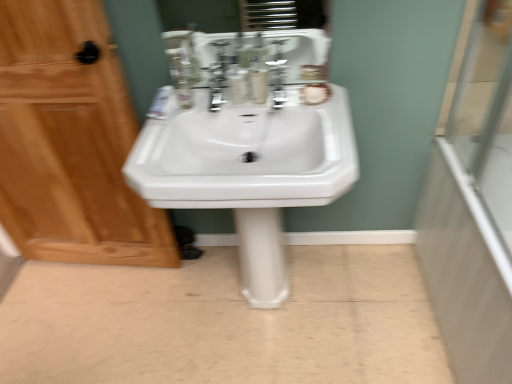
Locate an element on the screen. This screenshot has height=384, width=512. vacant region under wooden cabinet at left (from a real-world perspective) is located at coordinates (106, 269).